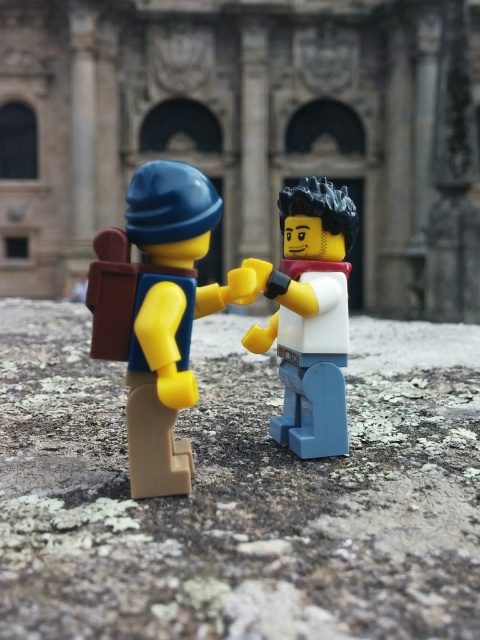
Which is in front, point (160, 397) or point (330, 278)?

Positioned in front is point (160, 397).

Image resolution: width=480 pixels, height=640 pixels. Identify the location of matte yellow backpack at left. (157, 312).

Locate an element on the screen. matte yellow backpack at left is located at coordinates (157, 312).